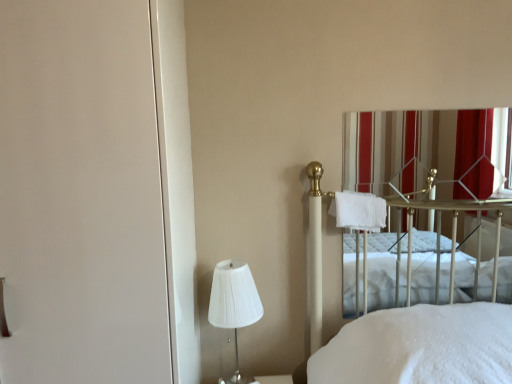
Question: Considering the positions of white pleated fabric lampshade at lower left and white soft towel at center-right in the image, is white pleated fabric lampshade at lower left bigger or smaller than white soft towel at center-right?

Choices:
 (A) small
 (B) big

Answer: (B)

Question: Is point (241, 296) positioned closer to the camera than point (359, 195)?

Choices:
 (A) farther
 (B) closer

Answer: (B)

Question: Which object is positioned closest to the white soft towel at center-right?

Choices:
 (A) striped fabric curtain at upper right
 (B) white pleated fabric lampshade at lower left
 (C) white matte screen door at left

Answer: (B)

Question: Which is nearer to the white matte screen door at left?

Choices:
 (A) white soft towel at center-right
 (B) white pleated fabric lampshade at lower left
 (C) striped fabric curtain at upper right

Answer: (B)